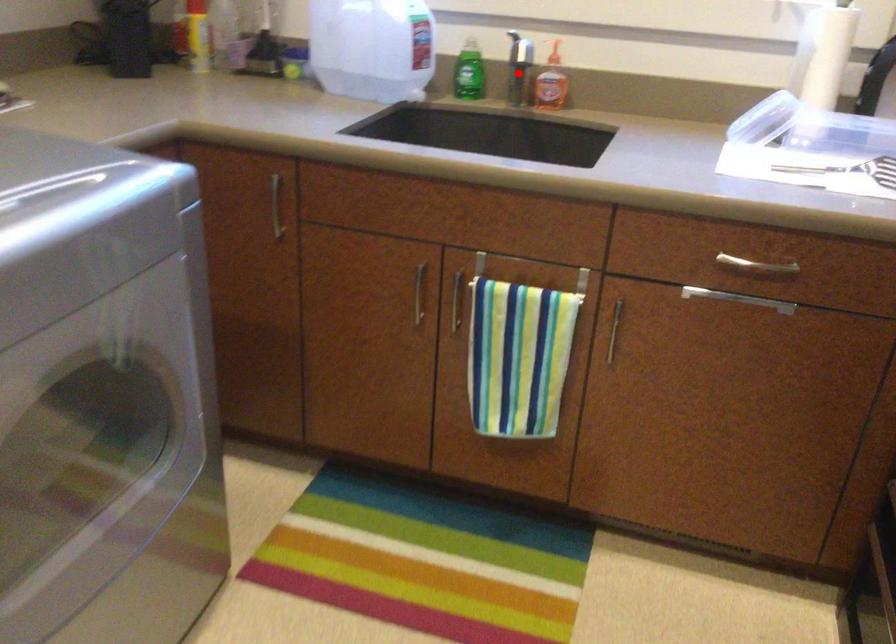
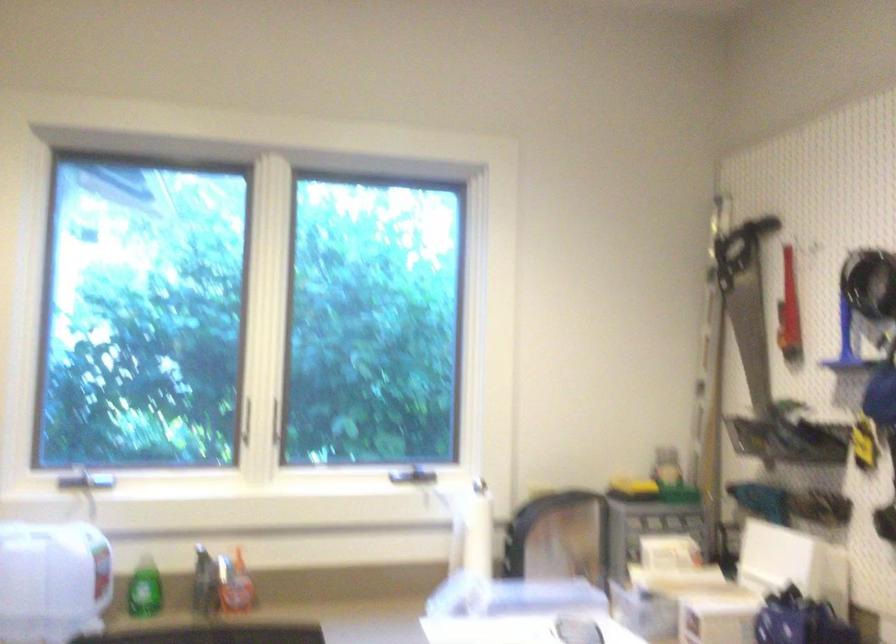
Find the pixel in the second image that matches the highlighted location in the first image.

(204, 583)